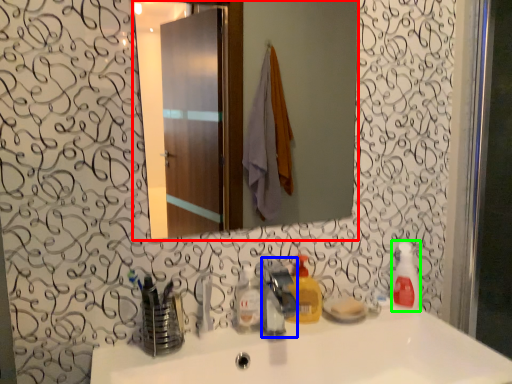
Question: Based on their relative distances, which object is farther from mirror (highlighted by a red box)? Choose from faucet (highlighted by a blue box) and soap dispenser (highlighted by a green box).

Choices:
 (A) faucet
 (B) soap dispenser

Answer: (A)